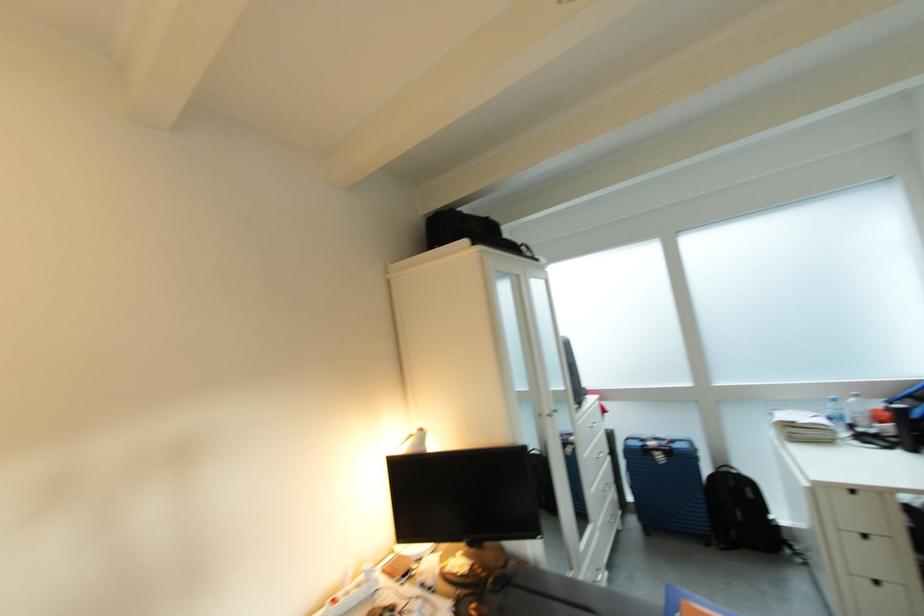
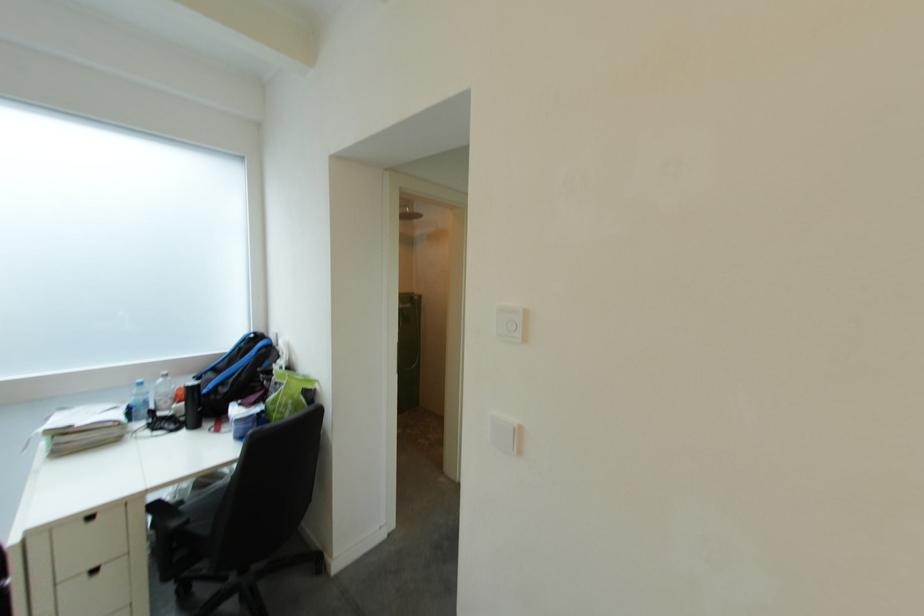
Find the pixel in the second image that matches the point at 842,422 in the first image.

(141, 411)